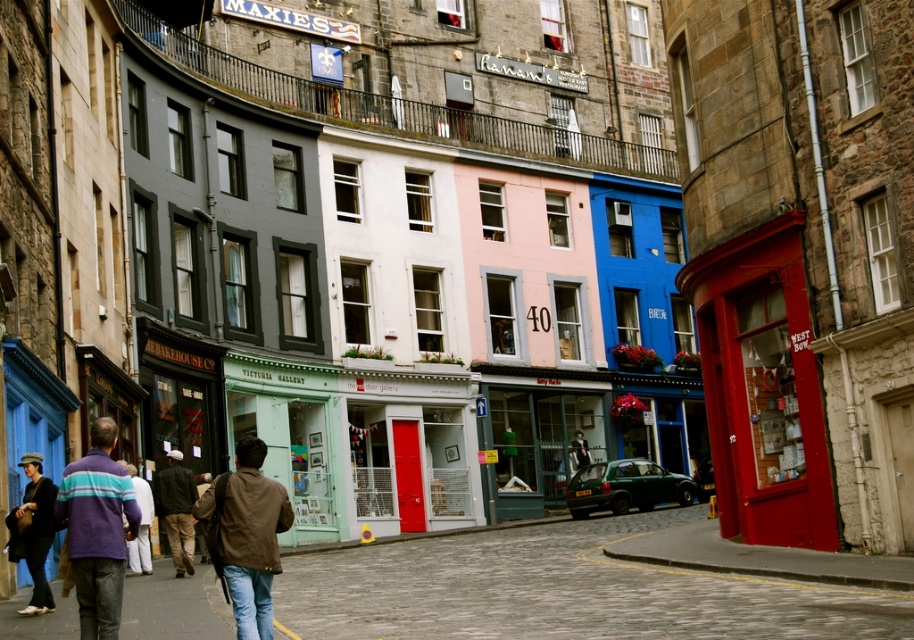
Consider the image. Which of these two, cobblestone pavement at center or matte black coat at lower left, stands taller?

cobblestone pavement at center

Is cobblestone pavement at center further to camera compared to matte black coat at lower left?

No, it is in front of matte black coat at lower left.

Based on the photo, who is more distant from viewer, [562,634] or [34,566]?

Positioned behind is point [34,566].

Find the location of a particular element. Image resolution: width=914 pixels, height=640 pixels. cobblestone pavement at center is located at coordinates (561, 589).

Is striped wool sweater at lower left closer to camera compared to brown leather jacket at center?

No, striped wool sweater at lower left is further to the viewer.

Who is more forward, (78, 516) or (248, 468)?

Point (248, 468) is in front.

Locate an element on the screen. This screenshot has width=914, height=640. striped wool sweater at lower left is located at coordinates tap(97, 531).

Between brown leather jacket at center and matte black coat at lower left, which one is positioned lower?

matte black coat at lower left is below.

What do you see at coordinates (248, 536) in the screenshot? I see `brown leather jacket at center` at bounding box center [248, 536].

I want to click on brown leather jacket at center, so click(248, 536).